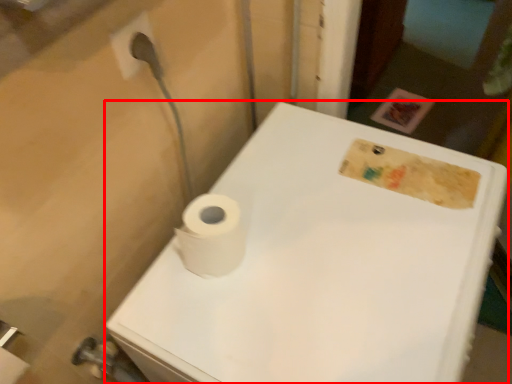
Question: From the image's perspective, what is the correct spatial relationship of porcelain (annotated by the red box) in relation to toilet paper?

Choices:
 (A) below
 (B) above

Answer: (A)